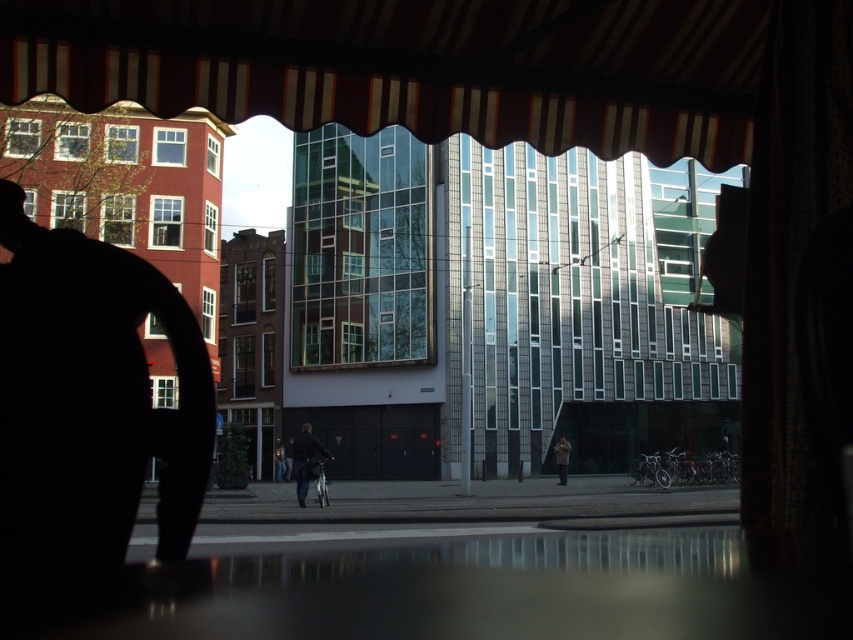
You are standing in a room and looking out through the window. You see the striped fabric awning at upper center and the dark blue jeans at center. Which object is positioned to the right when viewed from your perspective?

The striped fabric awning at upper center is to the right of the dark blue jeans at center.

You are a painter setting up an easel to capture the street scene through the window. You notice the striped fabric awning at upper center and the light brown leather jacket at center. Which object will block your view of the other if you position your easel directly in front of the window?

The striped fabric awning at upper center is in front of the light brown leather jacket at center, so it will block the view of the jacket.